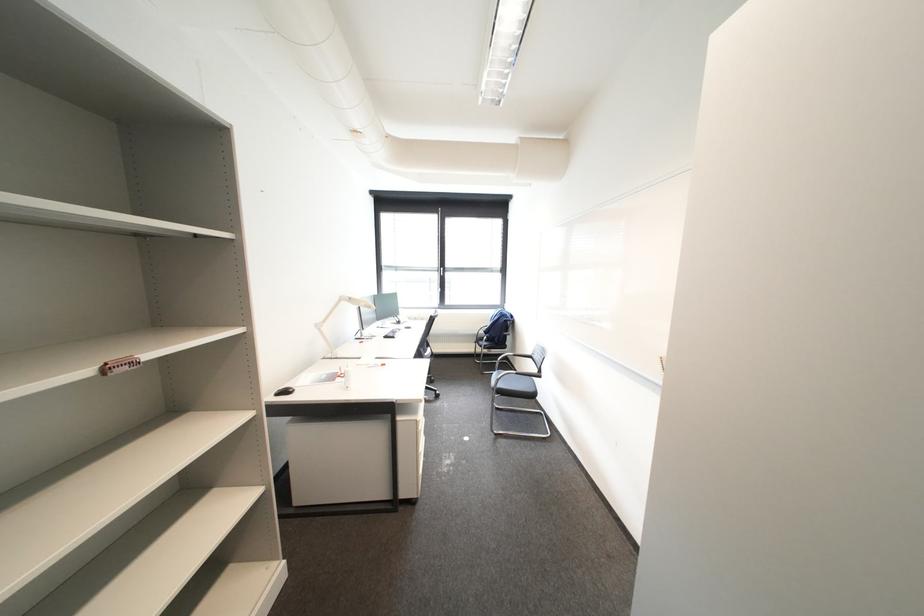
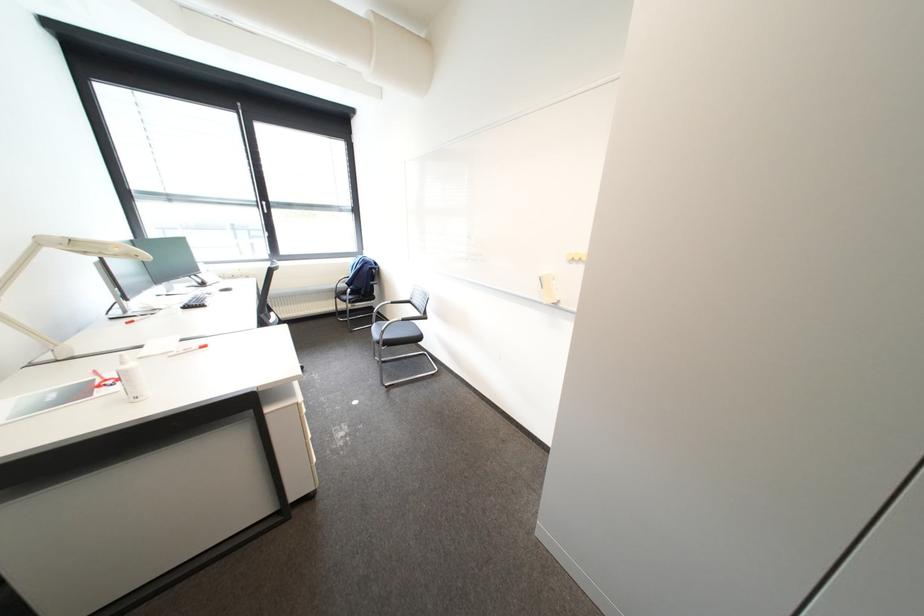
Question: The camera is either moving clockwise (left) or counter-clockwise (right) around the object. The first image is from the beginning of the video and the second image is from the end. Is the camera moving left or right when shooting the video?

Choices:
 (A) Left
 (B) Right

Answer: (A)